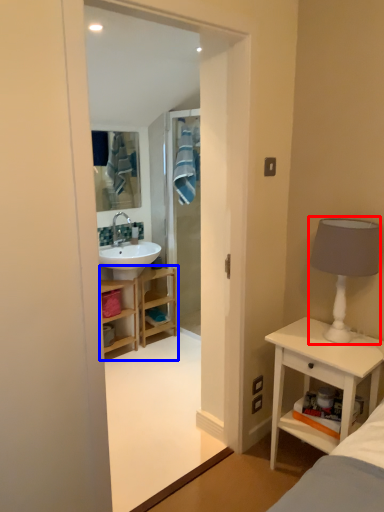
Question: Which object appears closest to the camera in this image, table lamp (highlighted by a red box) or bathroom cabinet (highlighted by a blue box)?

Choices:
 (A) table lamp
 (B) bathroom cabinet

Answer: (A)